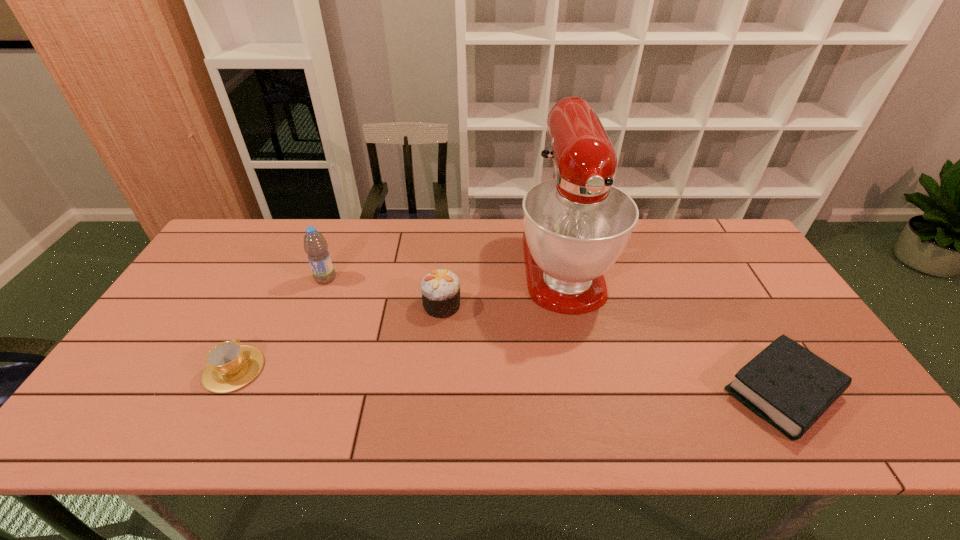
Find the location of a particular element. The width and height of the screenshot is (960, 540). the second object from right to left is located at coordinates (576, 225).

Locate an element on the screen. the tallest object is located at coordinates (576, 225).

You are a GUI agent. You are given a task and a screenshot of the screen. Output one action in this format:
    pyautogui.click(x=<x>, y=<y>)
    Task: Click on the fourth object from right to left
    The image size is (960, 540).
    Given the screenshot: What is the action you would take?
    pyautogui.click(x=315, y=245)

You are a GUI agent. You are given a task and a screenshot of the screen. Output one action in this format:
    pyautogui.click(x=<x>, y=<y>)
    Task: Click on the fourth shortest object
    
    Given the screenshot: What is the action you would take?
    pyautogui.click(x=315, y=245)

You are a GUI agent. You are given a task and a screenshot of the screen. Output one action in this format:
    pyautogui.click(x=<x>, y=<y>)
    Task: Click on the third shortest object
    
    Given the screenshot: What is the action you would take?
    pyautogui.click(x=440, y=289)

Identify the location of cupcake. Image resolution: width=960 pixels, height=540 pixels. (440, 289).

Identify the location of cup. (230, 366).

Where is `the rightmost object`? the rightmost object is located at coordinates (787, 385).

Image resolution: width=960 pixels, height=540 pixels. In order to click on vacant point located 0.150m at the attachment hub of the fourth object from left to right in this screenshot , I will do 584,366.

You are a GUI agent. You are given a task and a screenshot of the screen. Output one action in this format:
    pyautogui.click(x=<x>, y=<y>)
    Task: Click on the vacant space situated on the back of the fourth object from right to left
    
    Given the screenshot: What is the action you would take?
    pyautogui.click(x=337, y=249)